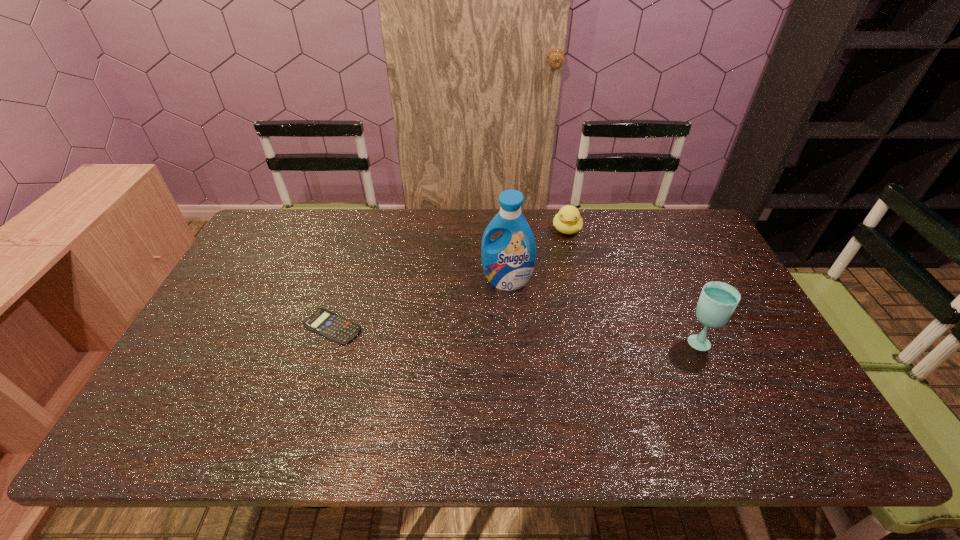
At what (x,y) coordinates should I click in order to perform the action: click on vacant region located 0.280m at the beak of the third object from left to right. Please return your answer as a coordinate pair (x, y). The width and height of the screenshot is (960, 540). Looking at the image, I should click on [x=556, y=297].

Identify the location of vacant space located at the beak of the third object from left to right. The image size is (960, 540). (550, 328).

Find the location of a particular element. vacant space located 0.250m at the beak of the third object from left to right is located at coordinates (557, 290).

I want to click on vacant region located 0.110m on the front-facing side of the second object from left to right, so click(x=492, y=318).

Where is `free space located 0.300m on the front-facing side of the second object from left to right`? free space located 0.300m on the front-facing side of the second object from left to right is located at coordinates (474, 373).

At what (x,y) coordinates should I click in order to perform the action: click on vacant space situated 0.110m on the front-facing side of the second object from left to right. Please return your answer as a coordinate pair (x, y). Image resolution: width=960 pixels, height=540 pixels. Looking at the image, I should click on (492, 318).

Identify the location of object present at the far edge. (568, 220).

Identify the location of object that is positioned at the right edge. (718, 300).

The image size is (960, 540). I want to click on vacant region at the far edge of the desktop, so click(481, 225).

In the image, there is a desktop. At what (x,y) coordinates should I click in order to perform the action: click on free space at the near edge. Please return your answer as a coordinate pair (x, y). This screenshot has height=540, width=960. Looking at the image, I should click on coord(424,381).